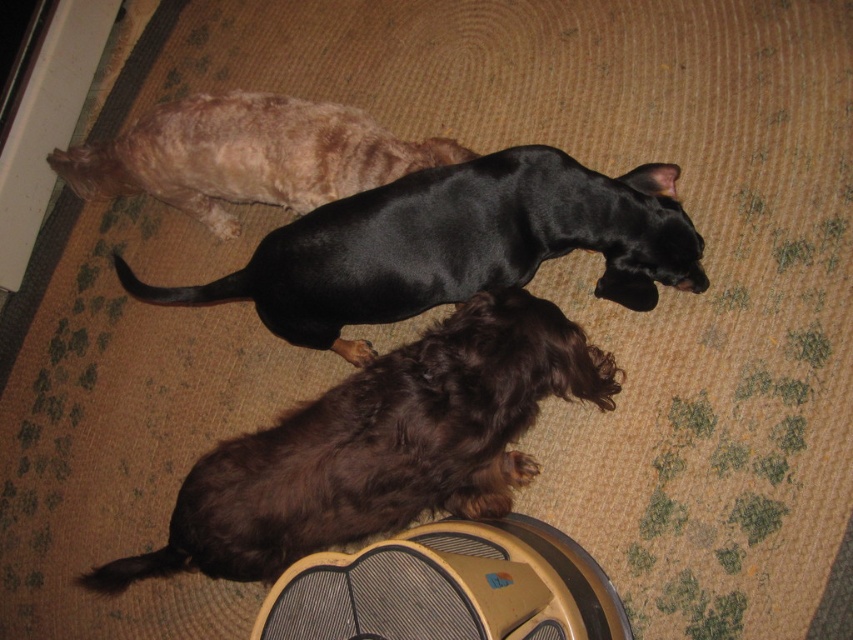
You are a photographer trying to capture a clear photo of both the brown fuzzy dog at lower center and the black glossy dog at center. Which dog will appear larger in the photo?

The brown fuzzy dog at lower center is much taller than the black glossy dog at center, so it will appear larger in the photo.

You are a pet sitter who needs to place a 24 inch wide pet bed between the brown fuzzy dog at lower center and the black shiny dog at upper center. Will the bed fit between them?

The distance between the brown fuzzy dog at lower center and the black shiny dog at upper center is 23.26 inches. Since the pet bed is 24 inches wide, it will not fit between them as the space is slightly narrower.

Consider the image. You are standing in a room with a carpeted floor. You see the gray fabric fan at lower center and the black shiny dog at upper center. Which object is nearer to you?

The gray fabric fan at lower center is closer to the viewer than the black shiny dog at upper center.